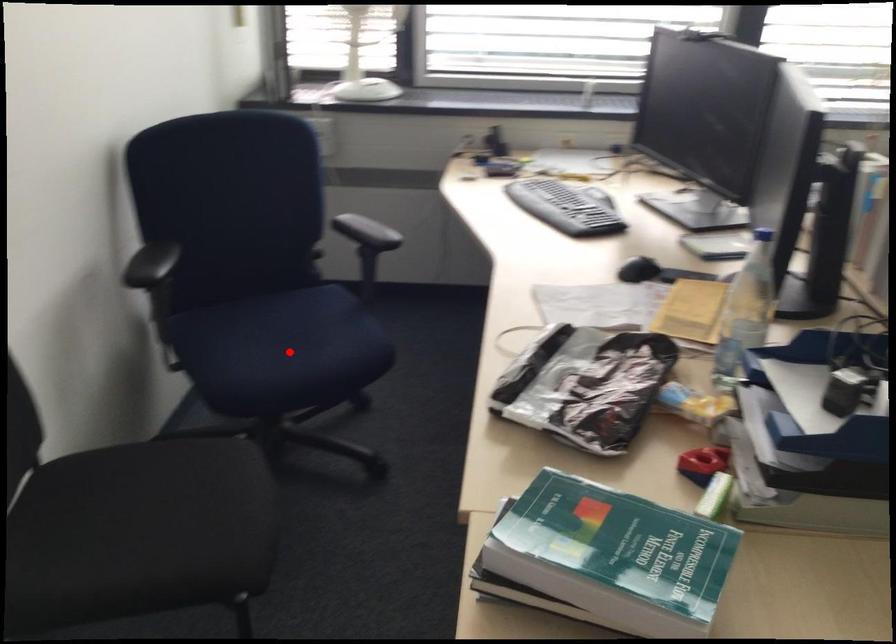
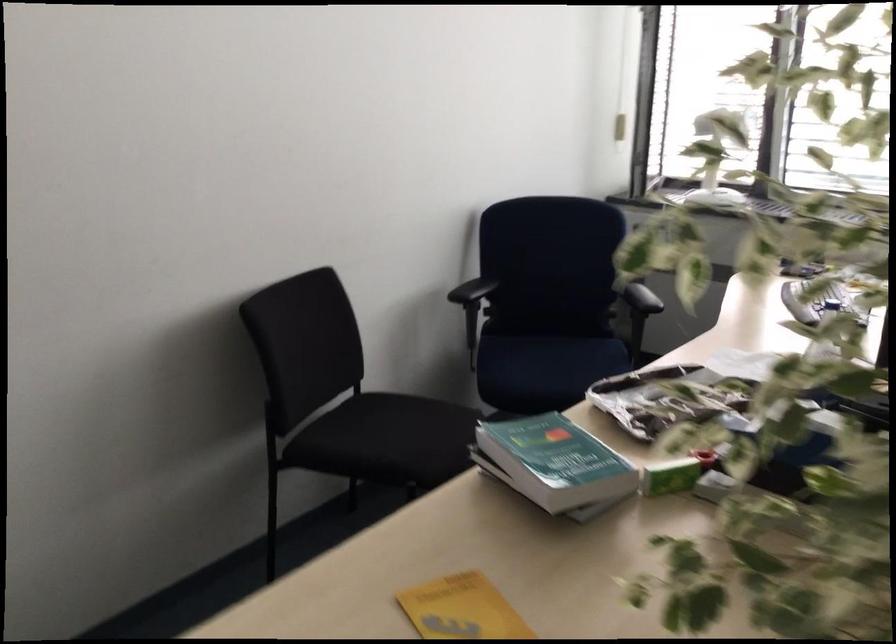
Where in the second image is the point corresponding to the highlighted location from the first image?

(547, 366)